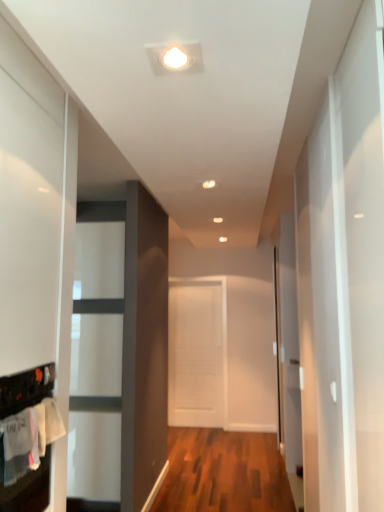
Question: Is point (52, 417) positioned closer to the camera than point (185, 285)?

Choices:
 (A) closer
 (B) farther

Answer: (A)

Question: From a real-world perspective, relative to white matte door at center, is white cotton laundry at lower left vertically above or below?

Choices:
 (A) below
 (B) above

Answer: (B)

Question: Based on their relative distances, which object is nearer to the white cotton laundry at lower left?

Choices:
 (A) white matte door at center
 (B) transparent glass door at right

Answer: (B)

Question: Which object is positioned farthest from the white matte door at center?

Choices:
 (A) transparent glass door at right
 (B) white cotton laundry at lower left

Answer: (B)